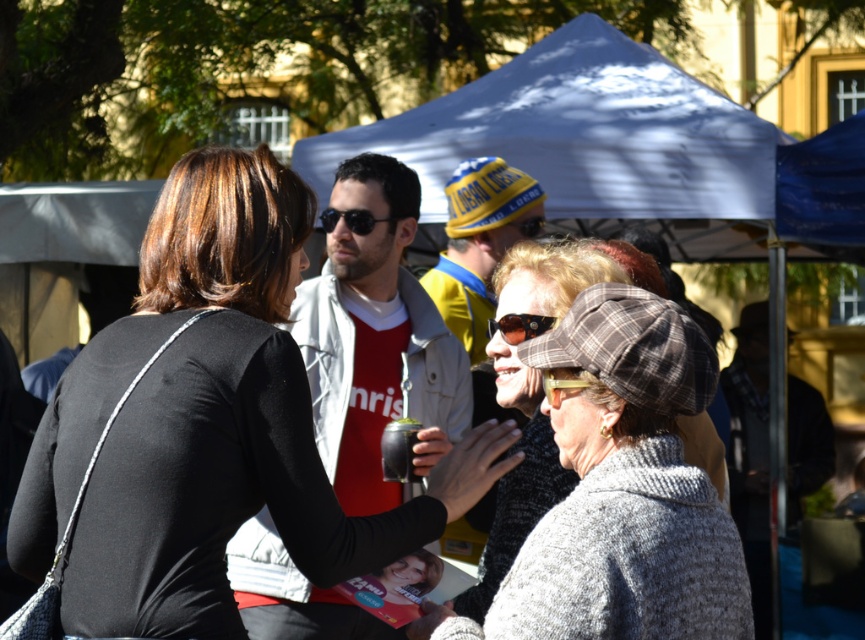
Question: Does black matte jacket at center have a larger size compared to black reflective sunglasses at center?

Choices:
 (A) no
 (B) yes

Answer: (B)

Question: Among these objects, which one is nearest to the camera?

Choices:
 (A) yellow fabric cap at center
 (B) plaid woolen hat at center

Answer: (B)

Question: Does plaid woolen hat at center have a greater width compared to sunglasses at center?

Choices:
 (A) no
 (B) yes

Answer: (B)

Question: In this image, where is matte black mate cup at center located relative to sunglasses at center?

Choices:
 (A) below
 (B) above

Answer: (A)

Question: Estimate the real-world distances between objects in this image. Which object is farther from the matte black mate cup at center?

Choices:
 (A) yellow fabric cap at center
 (B) black reflective sunglasses at center
 (C) black matte jacket at center

Answer: (C)

Question: Which point is farther to the camera?

Choices:
 (A) (530, 225)
 (B) (330, 285)
 (C) (395, 524)

Answer: (A)